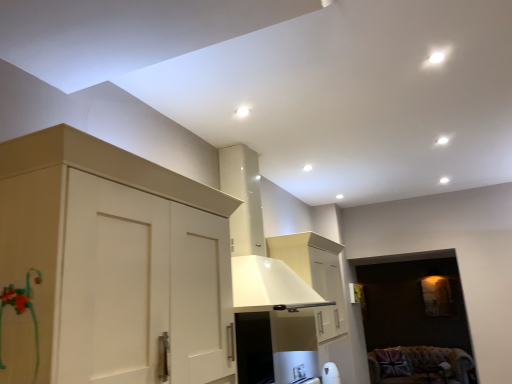
Question: Looking at their shapes, would you say white matte cabinet at left is wider or thinner than velvet union jack cushion at lower right?

Choices:
 (A) thin
 (B) wide

Answer: (A)

Question: Considering the positions of white matte cabinet at left and velvet union jack cushion at lower right in the image, is white matte cabinet at left taller or shorter than velvet union jack cushion at lower right?

Choices:
 (A) short
 (B) tall

Answer: (B)

Question: Does point (39, 254) appear closer or farther from the camera than point (387, 357)?

Choices:
 (A) closer
 (B) farther

Answer: (A)

Question: In terms of size, does velvet union jack cushion at lower right appear bigger or smaller than white matte cabinet at left?

Choices:
 (A) big
 (B) small

Answer: (A)

Question: From the image's perspective, is velvet union jack cushion at lower right located above or below white matte cabinet at left?

Choices:
 (A) below
 (B) above

Answer: (A)

Question: Considering the positions of point (423, 380) and point (117, 206), is point (423, 380) closer or farther from the camera than point (117, 206)?

Choices:
 (A) closer
 (B) farther

Answer: (B)

Question: From a real-world perspective, is velvet union jack cushion at lower right physically located above or below white matte cabinet at left?

Choices:
 (A) below
 (B) above

Answer: (A)